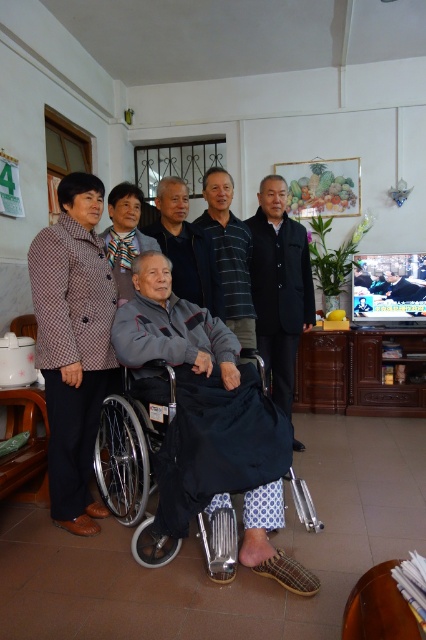
Question: Considering the real-world distances, which object is closest to the black matte suit at center?

Choices:
 (A) silver metallic wheelchair at center
 (B) striped cotton shirt at center

Answer: (B)

Question: In this image, where is black matte suit at center located relative to gray fabric jacket at center?

Choices:
 (A) above
 (B) below

Answer: (B)

Question: Is black matte suit at center smaller than striped cotton shirt at center?

Choices:
 (A) no
 (B) yes

Answer: (A)

Question: Is silver metallic wheelchair at center behind striped cotton shirt at center?

Choices:
 (A) no
 (B) yes

Answer: (A)

Question: Which of the following is the closest to the observer?

Choices:
 (A) (206, 264)
 (B) (85, 358)

Answer: (B)

Question: Which point is farther to the camera?

Choices:
 (A) striped cotton shirt at center
 (B) gray fabric jacket at center
 (C) black matte suit at center

Answer: (C)